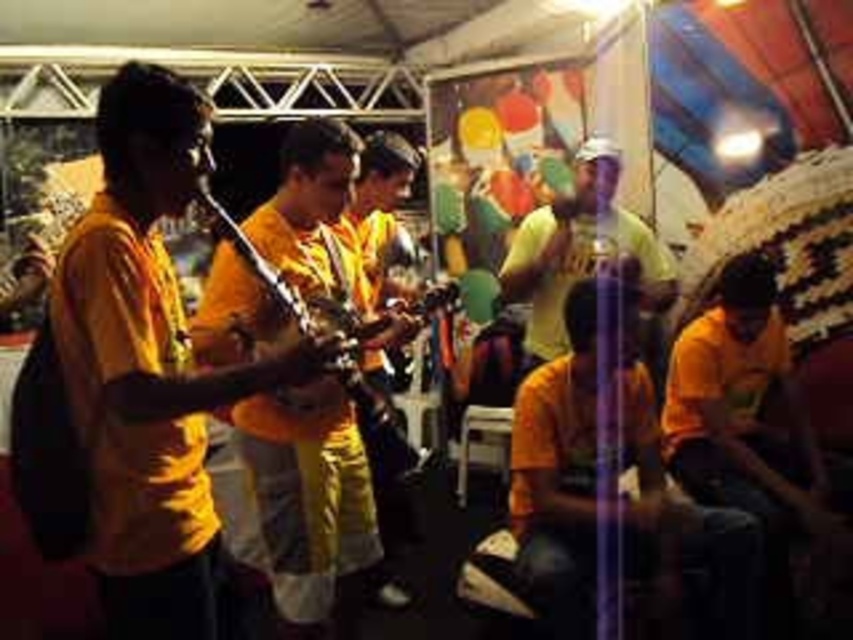
You are a photographer at the event and want to capture a photo of the metallic gold instrument at center without the matte yellow shirt at center blocking it. What should you do?

The metallic gold instrument at center is behind the matte yellow shirt at center, so you should move to a position where the matte yellow shirt at center is no longer in front of the metallic gold instrument at center to avoid blocking it.

You are a photographer at the event and want to capture the matte yellow shirt at center in your photo. The camera can only focus on objects within a circular area with a radius of 0.1 units centered at point (583,252). Will the matte yellow shirt at center be in focus?

Yes, the matte yellow shirt at center is exactly at point (583,252), so it will be in focus as it is at the center of the camera focus area.